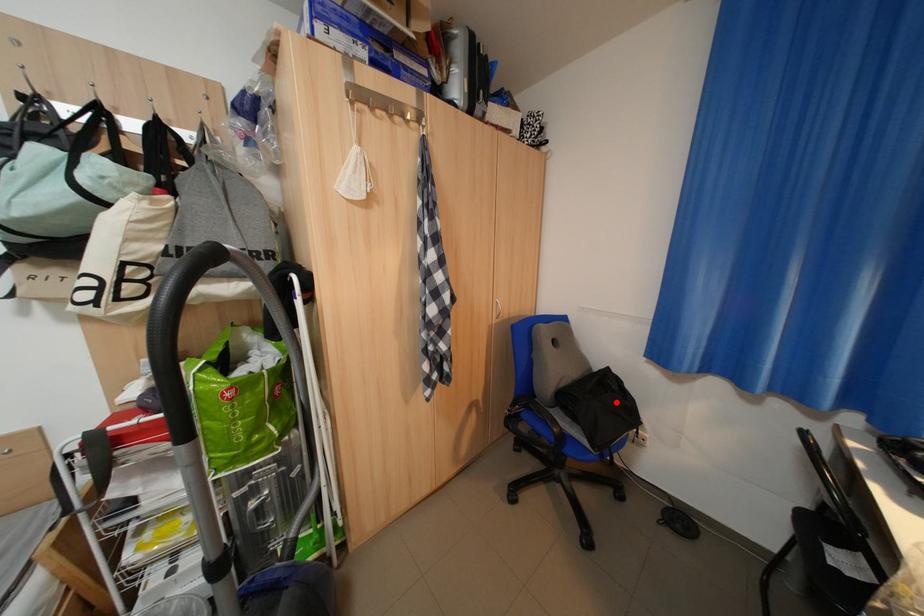
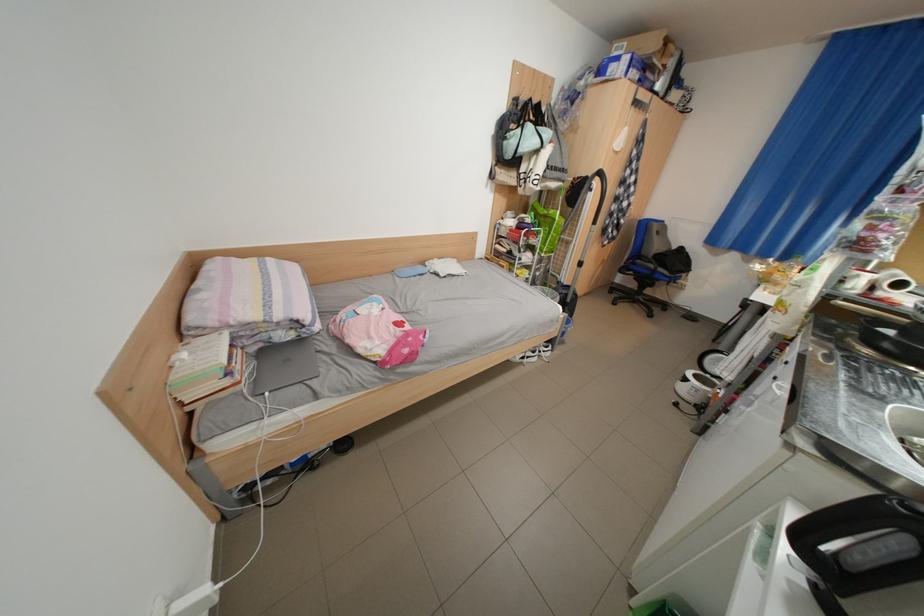
Question: A red point is marked in image1. In image2, is the corresponding 3D point closer to the camera or farther? Reply with the corresponding letter.

Choices:
 (A) The corresponding 3D point is closer.
 (B) The corresponding 3D point is farther.

Answer: (A)